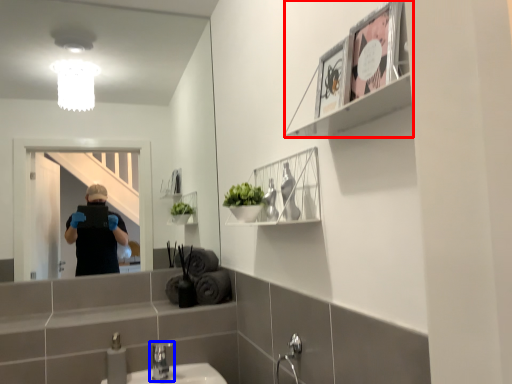
Question: Which of the following is the farthest to the observer, cabinet (highlighted by a red box) or tap (highlighted by a blue box)?

Choices:
 (A) cabinet
 (B) tap

Answer: (B)